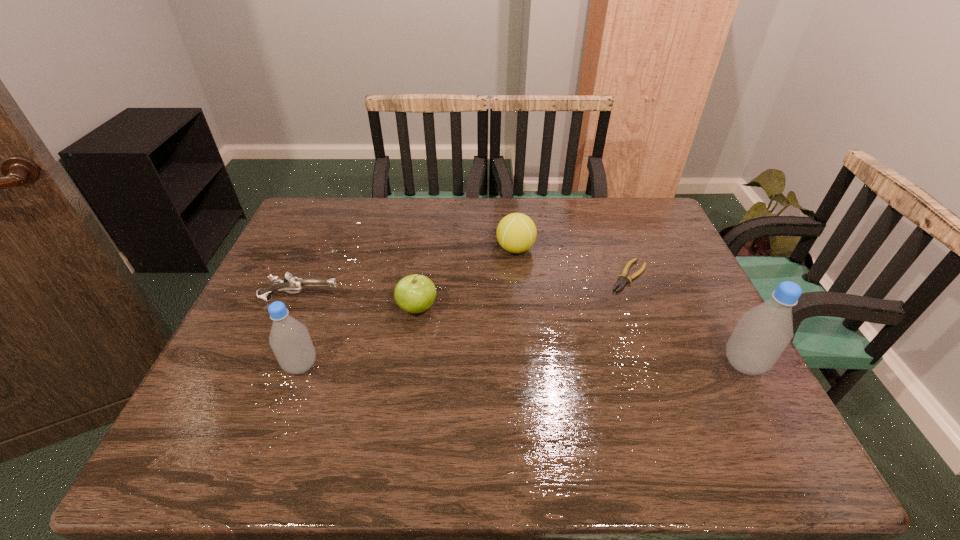
Find the location of a particular element. vacant point located between the tennis ball and the second object from right to left is located at coordinates (572, 262).

This screenshot has height=540, width=960. I want to click on vacant point located between the left bottle and the third object from left to right, so click(359, 337).

You are a GUI agent. You are given a task and a screenshot of the screen. Output one action in this format:
    pyautogui.click(x=<x>, y=<y>)
    Task: Click on the free space between the shorter bottle and the apple
    The height and width of the screenshot is (540, 960).
    Given the screenshot: What is the action you would take?
    click(x=359, y=337)

Identify the location of unoccupied area between the taller bottle and the fifth tallest object. This screenshot has width=960, height=540. (522, 332).

This screenshot has height=540, width=960. Find the location of `blank region between the shorter bottle and the rightmost object`. blank region between the shorter bottle and the rightmost object is located at coordinates (522, 364).

Where is `free spot between the second object from right to left and the gun`? Image resolution: width=960 pixels, height=540 pixels. free spot between the second object from right to left and the gun is located at coordinates (465, 287).

In order to click on empty location between the fourth object from right to left and the shorter bottle in this screenshot , I will do `click(359, 337)`.

Identify which object is the nearest to the third object from right to left. Please provide its 2D coordinates. Your answer should be formatted as a tuple, i.e. [(x, y)], where the tuple contains the x and y coordinates of a point satisfying the conditions above.

[(621, 283)]

At what (x,y) coordinates should I click in order to perform the action: click on object that stands as the second closest to the shorter bottle. Please return your answer as a coordinate pair (x, y). The height and width of the screenshot is (540, 960). Looking at the image, I should click on (416, 293).

Locate an element on the screen. Image resolution: width=960 pixels, height=540 pixels. vacant space that satisfies the following two spatial constraints: 1. aimed along the barrel of the fifth shortest object; 2. on the right side of the gun is located at coordinates (272, 365).